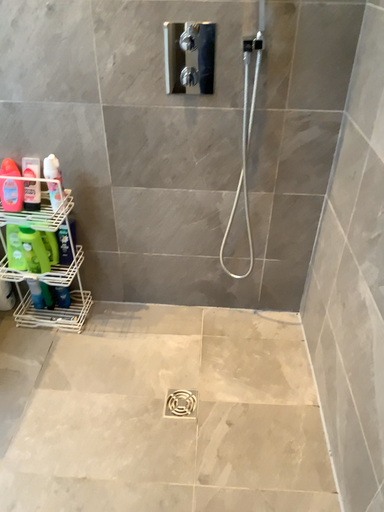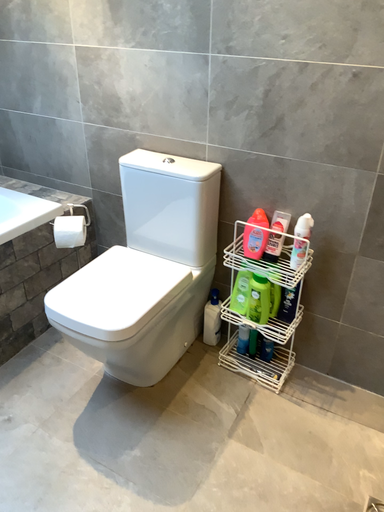
Question: How did the camera likely rotate when shooting the video?

Choices:
 (A) rotated left
 (B) rotated right

Answer: (A)